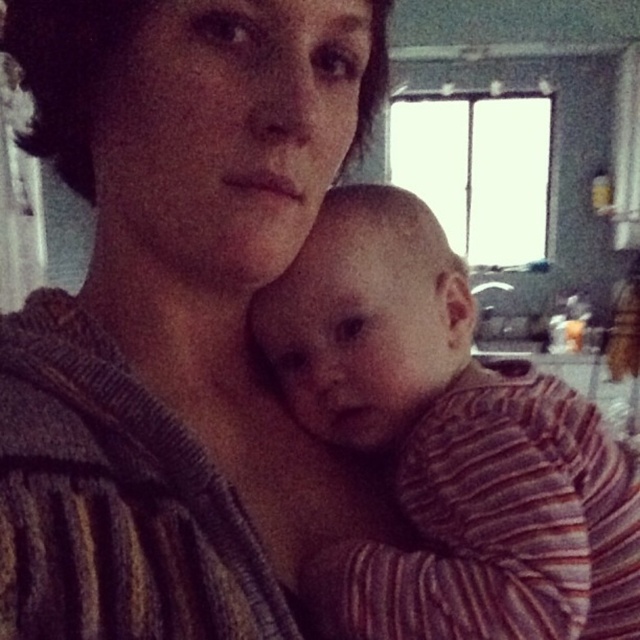
Measure the distance between striped sweater at center and camera.

striped sweater at center and camera are 13.19 inches apart.

This screenshot has height=640, width=640. Identify the location of striped sweater at center. (176, 314).

What do you see at coordinates (176, 314) in the screenshot?
I see `striped sweater at center` at bounding box center [176, 314].

Identify the location of striped sweater at center. The image size is (640, 640). (176, 314).